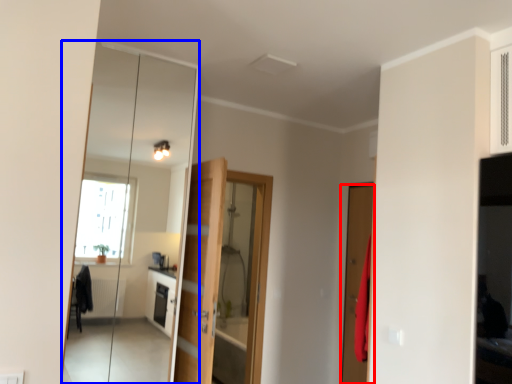
Question: Which object is closer to the camera taking this photo, door (highlighted by a red box) or mirror (highlighted by a blue box)?

Choices:
 (A) door
 (B) mirror

Answer: (B)